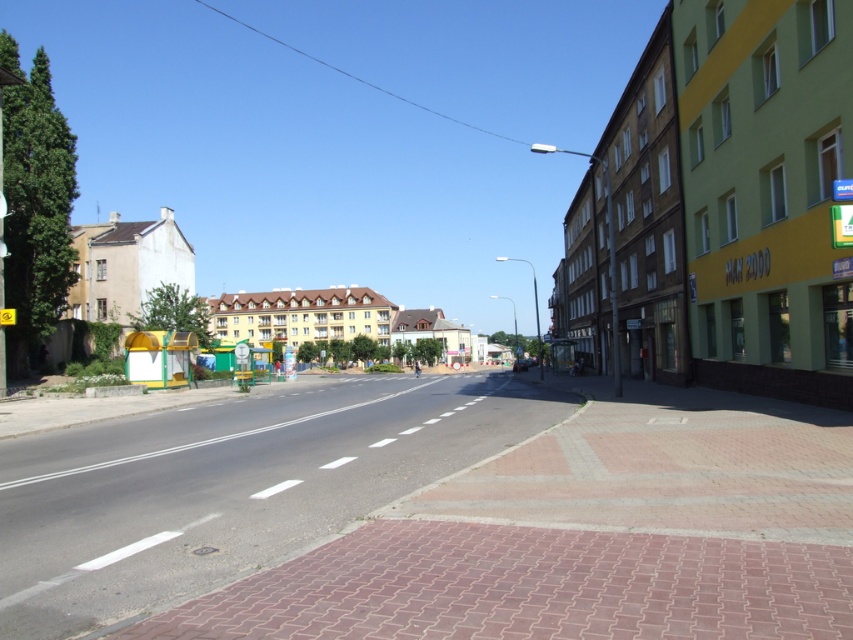
Question: Is green painted building at right in front of beige concrete building at left?

Choices:
 (A) yes
 (B) no

Answer: (A)

Question: Which point is farther to the camera?

Choices:
 (A) beige concrete building at left
 (B) green painted building at right

Answer: (A)

Question: Does green painted building at right appear over beige concrete building at left?

Choices:
 (A) no
 (B) yes

Answer: (A)

Question: Is the position of green painted building at right more distant than that of beige concrete building at left?

Choices:
 (A) yes
 (B) no

Answer: (B)